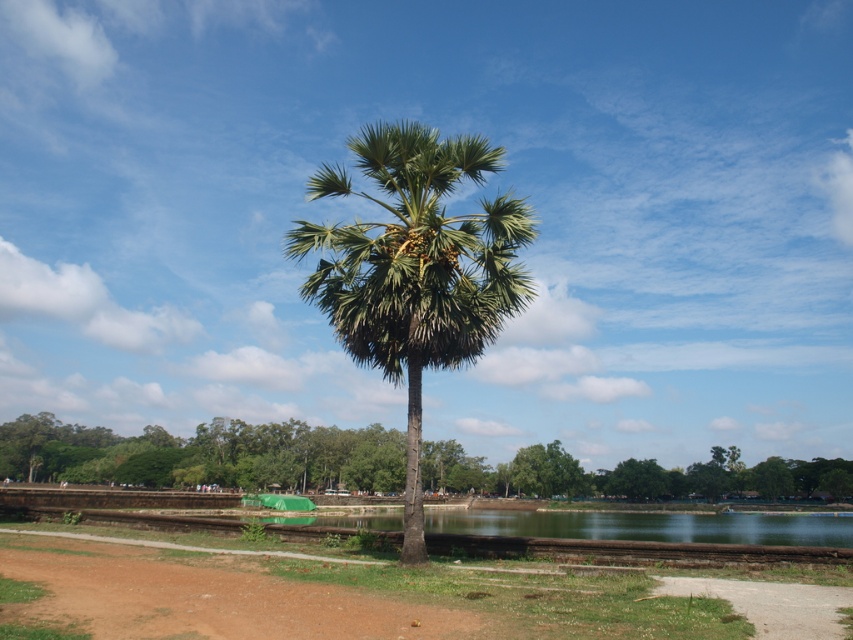
Question: Which point is closer to the camera taking this photo?

Choices:
 (A) (119, 632)
 (B) (495, 241)

Answer: (A)

Question: Which of these objects is positioned farthest from the green leafy tree at center?

Choices:
 (A) brown dirt track at lower left
 (B) green leafy palm tree at center

Answer: (A)

Question: Is green leafy tree at center to the left of brown dirt track at lower left from the viewer's perspective?

Choices:
 (A) yes
 (B) no

Answer: (A)

Question: Which object is closer to the camera taking this photo?

Choices:
 (A) green leafy tree at center
 (B) brown dirt track at lower left

Answer: (B)

Question: Where is green leafy palm tree at center located in relation to brown dirt track at lower left in the image?

Choices:
 (A) below
 (B) above

Answer: (B)

Question: Does green leafy tree at center have a lesser width compared to brown dirt track at lower left?

Choices:
 (A) yes
 (B) no

Answer: (B)